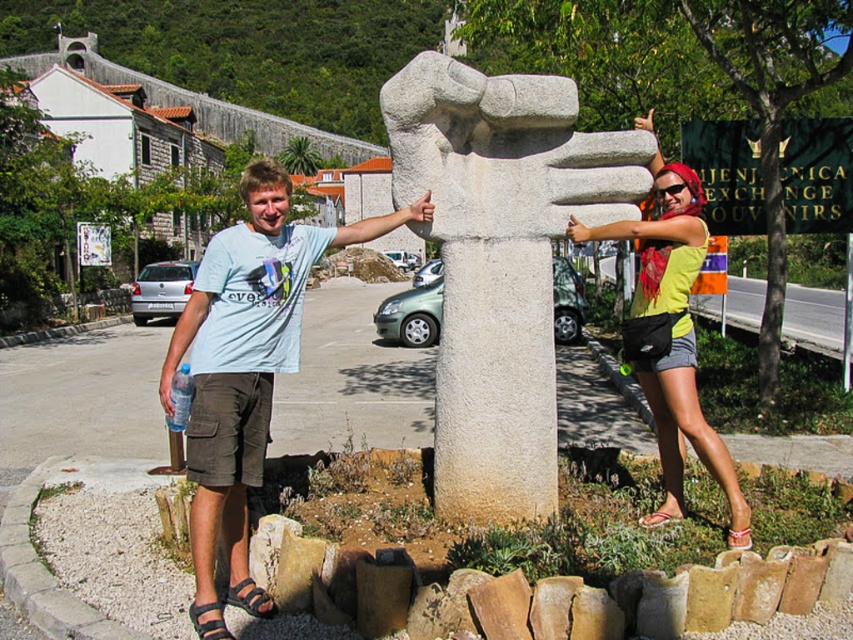
Based on the scene description, can you determine which stone structure is positioned to the left between the matte stone statue at center and the white stone sculpture at center?

The white stone sculpture at center is positioned to the left of the matte stone statue at center because the matte stone statue at center is to the right of the white stone sculpture at center.

You are standing at the center of the image and want to move towards the matte stone statue at center. Which direction should you go?

The matte stone statue at center is already at the center, so you are already facing it. No need to move in any direction.